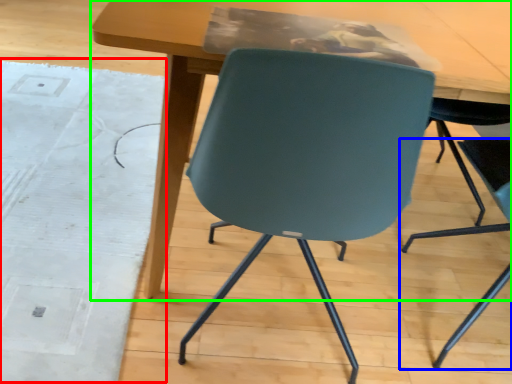
Question: Based on their relative distances, which object is farther from mat (highlighted by a red box)? Choose from chair (highlighted by a blue box) and table (highlighted by a green box).

Choices:
 (A) chair
 (B) table

Answer: (A)